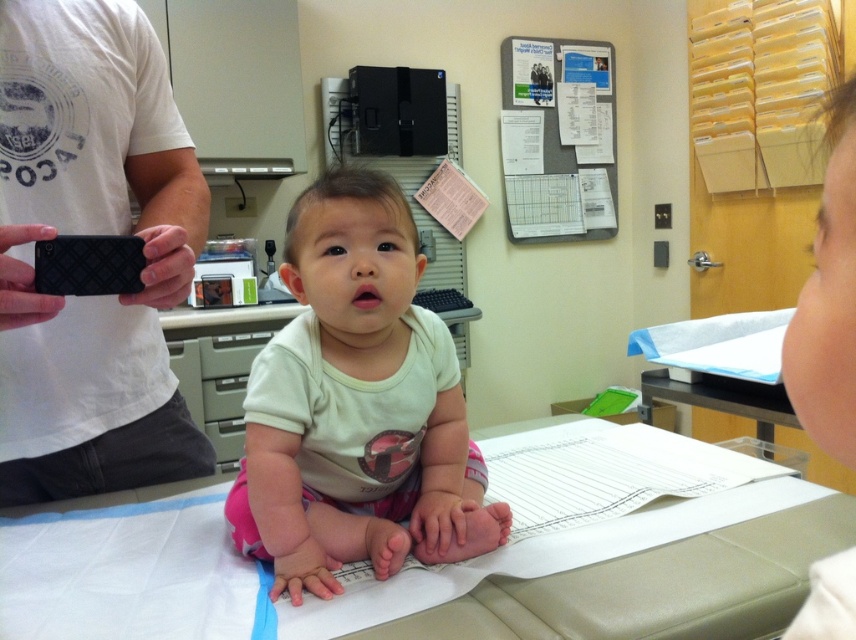
You are a photographer trying to capture a closeup shot of the light green cotton shirt at center. The black quilted phone at left is blocking your view. Can you move the phone to get a clear shot? Explain why or why not using the distance provided.

The distance between the black quilted phone at left and the light green cotton shirt at center is 24.66 centimeters. If moving the phone by at least this distance would allow it to no longer obstruct the view, then yes. However, without knowing the required clearance needed for the shot, it is uncertain. The photographer must ensure the phone is moved far enough away from the shirt to avoid obstruction.

You are a photographer in the examination room. You need to take a photo of the light green cotton shirt at center without the black quilted phone at left appearing in the frame. Is this possible based on their positions?

The black quilted phone at left is much taller than the light green cotton shirt at center, so the phone might block the view of the shirt depending on their positions. However, since the adult holding the phone is partially visible and the shirt is at center, adjusting the camera angle downward could allow capturing the shirt without the phone in the frame.

You are a photographer in the examination room. You need to capture a clear photo of the light green cotton shirt at center without the black quilted phone at left blocking the view. Is this possible?

The black quilted phone at left is in front of the light green cotton shirt at center, so it will block the view. Move the phone or adjust your angle to avoid the obstruction.